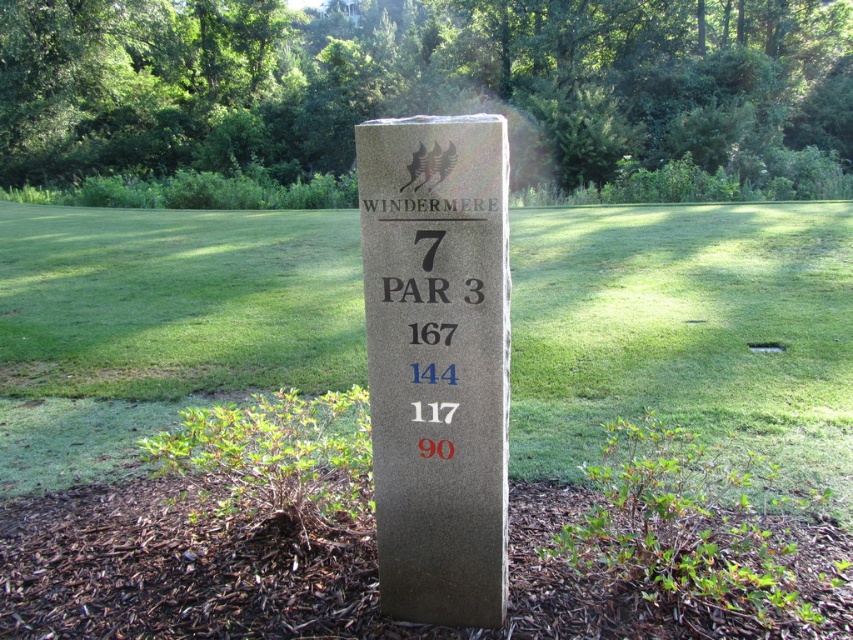
Question: Among these points, which one is nearest to the camera?

Choices:
 (A) (801, 417)
 (B) (479, 177)
 (C) (286, 150)

Answer: (B)

Question: In this image, where is green grass at center located relative to granite signpost at center?

Choices:
 (A) left
 (B) right

Answer: (A)

Question: Which of these objects is positioned farthest from the green leafy tree at upper center?

Choices:
 (A) granite signpost at center
 (B) green grass at center

Answer: (A)

Question: Is green grass at center further to the viewer compared to green leafy tree at upper center?

Choices:
 (A) yes
 (B) no

Answer: (B)

Question: Which point appears farthest from the camera in this image?

Choices:
 (A) (495, 410)
 (B) (672, 108)

Answer: (B)

Question: Is green leafy tree at upper center further to the viewer compared to granite signpost at center?

Choices:
 (A) no
 (B) yes

Answer: (B)